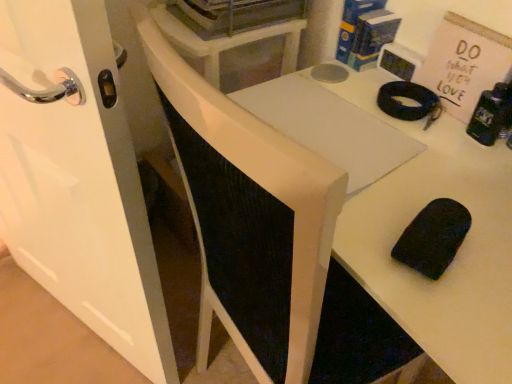
Identify the location of matte black clock at upper right, which appears as the second appliance when viewed from the top. (398, 61).

Identify the location of white matte table at center. The height and width of the screenshot is (384, 512). (411, 215).

Locate an element on the screen. This screenshot has height=384, width=512. white glossy door at left is located at coordinates (78, 177).

Consider the image. Is white matte table at center surrounded by white glossy door at left?

No, white matte table at center is not inside white glossy door at left.

This screenshot has height=384, width=512. In the image, there is a white glossy door at left. What are the coordinates of `table below it (from a real-world perspective)` in the screenshot? It's located at (411, 215).

Is white glossy door at left bigger or smaller than white matte table at center?

In the image, white glossy door at left appears to be smaller than white matte table at center.

Is white glossy door at left not near white matte table at center?

No, white glossy door at left is in close proximity to white matte table at center.

From the image's perspective, is white matte table at center located above or below matte black clock at upper right, the 1th appliance from the bottom?

Clearly, from the image's perspective, white matte table at center is below matte black clock at upper right, the 1th appliance from the bottom.

From the image's perspective, count 1st appliances upward from the white matte table at center and point to it. Please provide its 2D coordinates.

[(398, 61)]

Considering the relative positions of white matte table at center and matte black clock at upper right, which appears as the second appliance when viewed from the top, in the image provided, is white matte table at center to the left of matte black clock at upper right, which appears as the second appliance when viewed from the top, from the viewer's perspective?

Yes.

From a real-world perspective, is matte black clock at upper right, the first appliance from the right, on white matte table at center?

Correct, in the physical world, matte black clock at upper right, the first appliance from the right, is higher than white matte table at center.

Consider the image. Would you say matte black clock at upper right, the first appliance from the right, is outside white matte table at center?

Yes, matte black clock at upper right, the first appliance from the right, is located beyond the bounds of white matte table at center.

From the image's perspective, which is above, matte black clock at upper right, which appears as the second appliance when viewed from the top, or white matte table at center?

From the image's view, matte black clock at upper right, which appears as the second appliance when viewed from the top, is above.

Relative to white glossy door at left, is metallic gray dishwasher at upper center, which is the second appliance from right to left, in front or behind?

In the image, metallic gray dishwasher at upper center, which is the second appliance from right to left, appears behind white glossy door at left.

Find the location of a particular element. This screenshot has width=512, height=384. door in front of the metallic gray dishwasher at upper center, which is the second appliance from right to left is located at coordinates (78, 177).

Is point (264, 20) closer or farther from the camera than point (58, 201)?

Point (264, 20).

From a real-world perspective, who is located lower, metallic gray dishwasher at upper center, positioned as the first appliance in top-to-bottom order, or white glossy door at left?

white glossy door at left is physically lower.

Can you confirm if white glossy door at left is positioned to the left of matte black clock at upper right, the first appliance from the right?

Yes.

Based on the photo, is white glossy door at left positioned in front of matte black clock at upper right, the first appliance from the right?

Yes, it is in front of matte black clock at upper right, the first appliance from the right.

Is point (122, 174) closer to viewer compared to point (412, 75)?

Yes, it is.

Looking at the image, does metallic gray dishwasher at upper center, positioned as the first appliance in top-to-bottom order, seem bigger or smaller compared to matte black clock at upper right, which is the 2th appliance from left to right?

Clearly, metallic gray dishwasher at upper center, positioned as the first appliance in top-to-bottom order, is larger in size than matte black clock at upper right, which is the 2th appliance from left to right.

From the image's perspective, is metallic gray dishwasher at upper center, positioned as the first appliance in top-to-bottom order, below matte black clock at upper right, the first appliance from the right?

Incorrect, from the image's perspective, metallic gray dishwasher at upper center, positioned as the first appliance in top-to-bottom order, is higher than matte black clock at upper right, the first appliance from the right.

Which object is wider, metallic gray dishwasher at upper center, which is the second appliance from right to left, or matte black clock at upper right, which appears as the second appliance when viewed from the top?

With larger width is metallic gray dishwasher at upper center, which is the second appliance from right to left.

The height and width of the screenshot is (384, 512). I want to click on appliance that is above the matte black clock at upper right, which is the 2th appliance from left to right (from the image's perspective), so pos(234,15).

From a real-world perspective, is matte black clock at upper right, which appears as the second appliance when viewed from the top, positioned above or below white glossy door at left?

Clearly, from a real-world perspective, matte black clock at upper right, which appears as the second appliance when viewed from the top, is above white glossy door at left.

Which is nearer, (421, 59) or (58, 173)?

Point (421, 59).

Image resolution: width=512 pixels, height=384 pixels. Find the location of `the 1st appliance positioned above the white glossy door at left (from the image's perspective)`. the 1st appliance positioned above the white glossy door at left (from the image's perspective) is located at coordinates (398, 61).

Identify the location of table located on the right of white glossy door at left. (411, 215).

What are the coordinates of `table below the matte black clock at upper right, the 1th appliance from the bottom (from a real-world perspective)` in the screenshot? It's located at (411, 215).

Considering their positions, is matte black clock at upper right, the first appliance from the right, positioned further to white glossy door at left than white matte table at center?

Among the two, matte black clock at upper right, the first appliance from the right, is located further to white glossy door at left.

Considering their positions, is metallic gray dishwasher at upper center, positioned as the first appliance in top-to-bottom order, positioned closer to matte black clock at upper right, the first appliance from the right, than white glossy door at left?

Among the two, metallic gray dishwasher at upper center, positioned as the first appliance in top-to-bottom order, is located nearer to matte black clock at upper right, the first appliance from the right.

Considering their positions, is white matte table at center positioned closer to matte black clock at upper right, which appears as the second appliance when viewed from the top, than metallic gray dishwasher at upper center, positioned as the first appliance in top-to-bottom order?

white matte table at center is closer to matte black clock at upper right, which appears as the second appliance when viewed from the top.

Considering their positions, is matte black clock at upper right, which appears as the second appliance when viewed from the top, positioned further to white matte table at center than white glossy door at left?

Based on the image, white glossy door at left appears to be further to white matte table at center.

When comparing their distances from matte black clock at upper right, the first appliance from the right, does white glossy door at left or white matte table at center seem closer?

The object closer to matte black clock at upper right, the first appliance from the right, is white matte table at center.

When comparing their distances from white matte table at center, does metallic gray dishwasher at upper center, the 2th appliance in the bottom-to-top sequence, or matte black clock at upper right, the 1th appliance from the bottom, seem closer?

matte black clock at upper right, the 1th appliance from the bottom, is closer to white matte table at center.

Considering their positions, is matte black clock at upper right, the 1th appliance from the bottom, positioned closer to metallic gray dishwasher at upper center, positioned as the first appliance in top-to-bottom order, than white glossy door at left?

Based on the image, matte black clock at upper right, the 1th appliance from the bottom, appears to be nearer to metallic gray dishwasher at upper center, positioned as the first appliance in top-to-bottom order.

Based on their spatial positions, is white glossy door at left or matte black clock at upper right, the 1th appliance from the bottom, closer to white matte table at center?

matte black clock at upper right, the 1th appliance from the bottom.

You are a GUI agent. You are given a task and a screenshot of the screen. Output one action in this format:
    pyautogui.click(x=<x>, y=<y>)
    Task: Click on the door between metallic gray dishwasher at upper center, the first appliance in the left-to-right sequence, and white matte table at center from top to bottom
    The width and height of the screenshot is (512, 384).
    Given the screenshot: What is the action you would take?
    pyautogui.click(x=78, y=177)

This screenshot has height=384, width=512. Find the location of `appliance between metallic gray dishwasher at upper center, which is the second appliance from right to left, and white matte table at center in the up-down direction`. appliance between metallic gray dishwasher at upper center, which is the second appliance from right to left, and white matte table at center in the up-down direction is located at coordinates (398, 61).

Locate an element on the screen. The width and height of the screenshot is (512, 384). appliance between white glossy door at left and matte black clock at upper right, the 1th appliance from the bottom, from left to right is located at coordinates (234, 15).

Locate an element on the screen. Image resolution: width=512 pixels, height=384 pixels. table located between white glossy door at left and matte black clock at upper right, which is the 2th appliance from left to right, in the left-right direction is located at coordinates (411, 215).